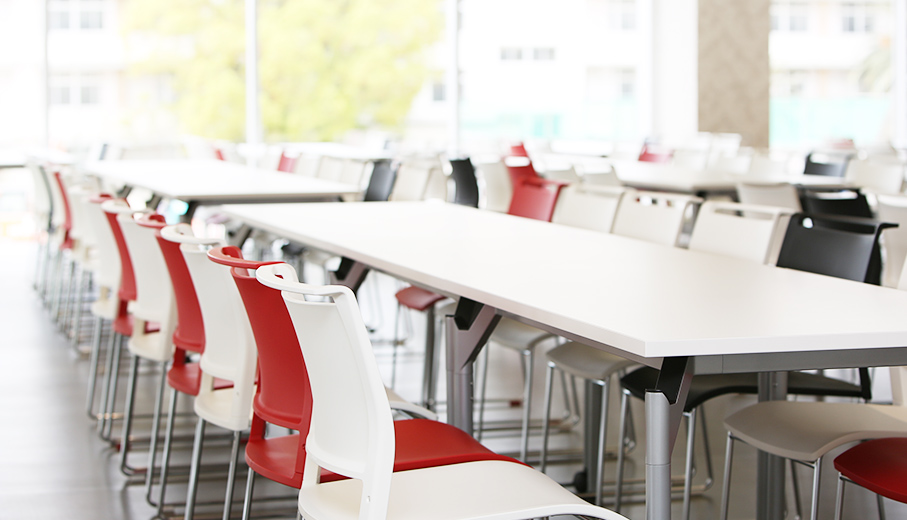
Where is `table top`? This screenshot has width=907, height=520. table top is located at coordinates (348, 153), (211, 189), (518, 281), (673, 177).